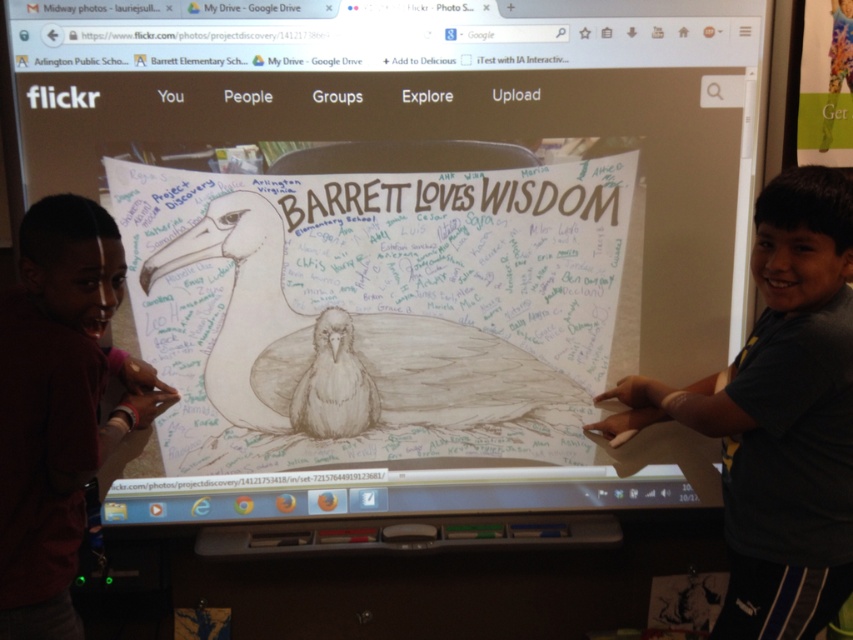
You are a photographer standing 1.5 meters away from the screen. You want to take a photo of the point at coordinates point (766, 378). Can you reach the point without moving closer than your current position?

The distance of point (766, 378) from camera is 1.61 meters. Since you are currently 1.5 meters away, you need to move 0.11 meters closer to reach the point.

You are a photographer trying to capture a photo of the white chalkboard writing at center and the dark red shirt at left. Since you want to ensure both are in focus, you need to know which object is wider. Which one is wider?

The white chalkboard writing at center is wider than the dark red shirt at left because the dark red shirt at left has a smaller width.